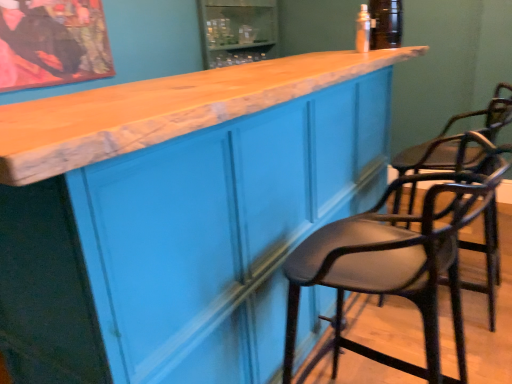
Question: Does matte black bar stool at right, arranged as the first chair when viewed from the front, lie in front of black leather chair at right, which appears as the first chair when viewed from the back?

Choices:
 (A) no
 (B) yes

Answer: (B)

Question: Is matte black bar stool at right, the 2th chair when ordered from back to front, taller than black leather chair at right, which appears as the first chair when viewed from the back?

Choices:
 (A) yes
 (B) no

Answer: (B)

Question: Does matte black bar stool at right, arranged as the first chair when viewed from the front, have a larger size compared to black leather chair at right, which appears as the first chair when viewed from the back?

Choices:
 (A) no
 (B) yes

Answer: (A)

Question: From a real-world perspective, is matte black bar stool at right, the 2th chair when ordered from back to front, on top of black leather chair at right, positioned as the 2th chair in front-to-back order?

Choices:
 (A) no
 (B) yes

Answer: (A)

Question: Is there a large distance between matte black bar stool at right, arranged as the first chair when viewed from the front, and black leather chair at right, which appears as the first chair when viewed from the back?

Choices:
 (A) no
 (B) yes

Answer: (A)

Question: Is matte black bar stool at right, arranged as the first chair when viewed from the front, wider than black leather chair at right, which appears as the first chair when viewed from the back?

Choices:
 (A) yes
 (B) no

Answer: (B)

Question: Does matte black bar stool at right, the 2th chair when ordered from back to front, appear on the right side of clear plastic bottle at upper center?

Choices:
 (A) yes
 (B) no

Answer: (B)

Question: Is matte black bar stool at right, the 2th chair when ordered from back to front, wider than clear plastic bottle at upper center?

Choices:
 (A) yes
 (B) no

Answer: (A)

Question: Is matte black bar stool at right, the 2th chair when ordered from back to front, facing away from clear plastic bottle at upper center?

Choices:
 (A) no
 (B) yes

Answer: (A)

Question: Are matte black bar stool at right, the 2th chair when ordered from back to front, and clear plastic bottle at upper center located far from each other?

Choices:
 (A) yes
 (B) no

Answer: (A)

Question: From the image's perspective, does matte black bar stool at right, the 2th chair when ordered from back to front, appear higher than clear plastic bottle at upper center?

Choices:
 (A) no
 (B) yes

Answer: (A)

Question: Does matte black bar stool at right, arranged as the first chair when viewed from the front, have a lesser width compared to clear plastic bottle at upper center?

Choices:
 (A) yes
 (B) no

Answer: (B)

Question: Considering the relative sizes of matte blue cabinet at center and matte black bar stool at right, the 2th chair when ordered from back to front, in the image provided, is matte blue cabinet at center taller than matte black bar stool at right, the 2th chair when ordered from back to front,?

Choices:
 (A) yes
 (B) no

Answer: (A)